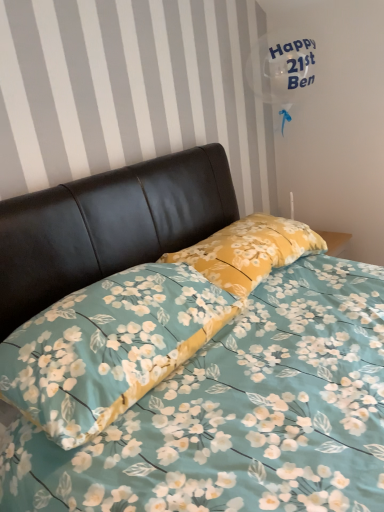
Question: Is yellow floral pillow at center, the 2th pillow from the front, facing towards floral fabric pillow at center, arranged as the 1th pillow when viewed from the front?

Choices:
 (A) no
 (B) yes

Answer: (A)

Question: Can you confirm if yellow floral pillow at center, the 2th pillow from the front, is taller than floral fabric pillow at center, arranged as the 1th pillow when viewed from the front?

Choices:
 (A) no
 (B) yes

Answer: (A)

Question: Considering the relative positions of yellow floral pillow at center, which appears as the 1th pillow when viewed from the back, and floral fabric pillow at center, arranged as the 1th pillow when viewed from the front, in the image provided, is yellow floral pillow at center, which appears as the 1th pillow when viewed from the back, behind floral fabric pillow at center, arranged as the 1th pillow when viewed from the front,?

Choices:
 (A) no
 (B) yes

Answer: (B)

Question: Can you confirm if yellow floral pillow at center, the 2th pillow from the front, is shorter than floral fabric pillow at center, arranged as the 1th pillow when viewed from the front?

Choices:
 (A) no
 (B) yes

Answer: (B)

Question: Is yellow floral pillow at center, the 2th pillow from the front, at the right side of floral fabric pillow at center, positioned as the second pillow in back-to-front order?

Choices:
 (A) no
 (B) yes

Answer: (B)

Question: From a real-world perspective, is yellow floral pillow at center, which appears as the 1th pillow when viewed from the back, physically above floral fabric pillow at center, arranged as the 1th pillow when viewed from the front?

Choices:
 (A) yes
 (B) no

Answer: (A)

Question: Considering the relative sizes of floral fabric pillow at center, arranged as the 1th pillow when viewed from the front, and yellow floral pillow at center, which appears as the 1th pillow when viewed from the back, in the image provided, is floral fabric pillow at center, arranged as the 1th pillow when viewed from the front, thinner than yellow floral pillow at center, which appears as the 1th pillow when viewed from the back,?

Choices:
 (A) no
 (B) yes

Answer: (A)

Question: Is the depth of floral fabric pillow at center, arranged as the 1th pillow when viewed from the front, greater than that of yellow floral pillow at center, the 2th pillow from the front?

Choices:
 (A) no
 (B) yes

Answer: (A)

Question: Does floral fabric pillow at center, arranged as the 1th pillow when viewed from the front, have a smaller size compared to yellow floral pillow at center, which appears as the 1th pillow when viewed from the back?

Choices:
 (A) yes
 (B) no

Answer: (B)

Question: Is floral fabric pillow at center, positioned as the second pillow in back-to-front order, oriented towards yellow floral pillow at center, the 2th pillow from the front?

Choices:
 (A) no
 (B) yes

Answer: (A)

Question: From the image's perspective, is floral fabric pillow at center, positioned as the second pillow in back-to-front order, on yellow floral pillow at center, the 2th pillow from the front?

Choices:
 (A) yes
 (B) no

Answer: (B)

Question: Is floral fabric pillow at center, positioned as the second pillow in back-to-front order, shorter than yellow floral pillow at center, the 2th pillow from the front?

Choices:
 (A) no
 (B) yes

Answer: (A)

Question: Does point [261, 227] appear closer or farther from the camera than point [145, 379]?

Choices:
 (A) closer
 (B) farther

Answer: (B)